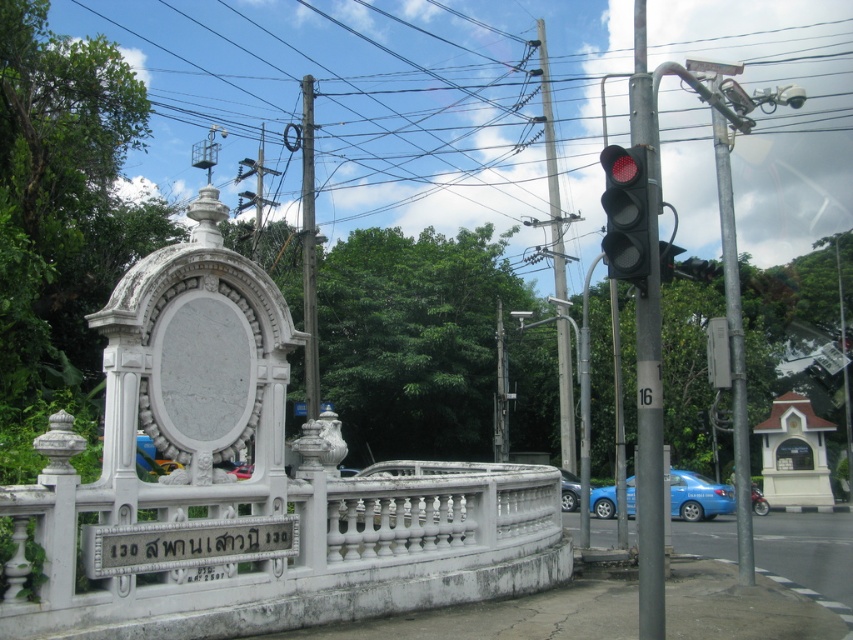
Question: Is metallic pole at right positioned before matte black traffic light at upper right?

Choices:
 (A) yes
 (B) no

Answer: (B)

Question: Which of these objects is positioned closest to the metallic pole at center?

Choices:
 (A) white stone sign at lower center
 (B) blue glossy car at lower center
 (C) blue matte taxi at lower right

Answer: (A)

Question: Considering the real-world distances, which object is closest to the blue matte taxi at lower right?

Choices:
 (A) metallic pole at right
 (B) blue glossy car at lower center
 (C) blue metallic car at lower right
 (D) white stone sign at lower center

Answer: (C)

Question: Can you confirm if metallic pole at center is positioned below blue metallic car at lower right?

Choices:
 (A) no
 (B) yes

Answer: (A)

Question: In this image, where is black plastic traffic light at right located relative to metallic pole at right?

Choices:
 (A) below
 (B) above

Answer: (A)

Question: Which of the following is the closest to the observer?

Choices:
 (A) black plastic traffic light at right
 (B) blue metallic car at lower right
 (C) metallic pole at upper center

Answer: (A)